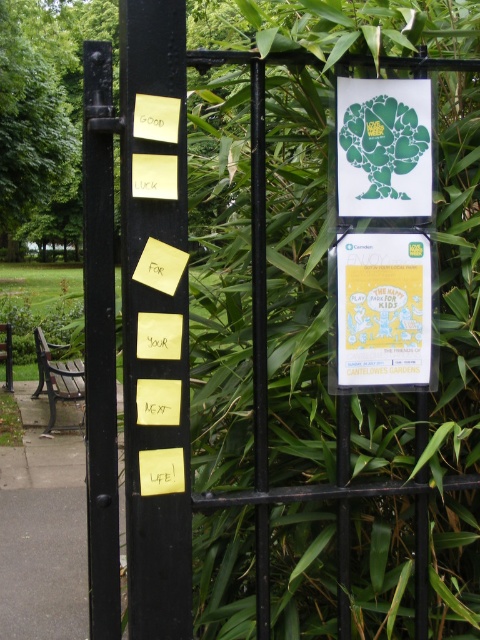
Question: Does wooden bench at lower left lie in front of wooden bench at left?

Choices:
 (A) no
 (B) yes

Answer: (B)

Question: Can you confirm if black metal post at left is positioned to the left of matte paper poster at upper right?

Choices:
 (A) yes
 (B) no

Answer: (A)

Question: Does matte paper poster at upper right appear on the left side of wooden bench at left?

Choices:
 (A) no
 (B) yes

Answer: (A)

Question: Which point is closer to the camera?

Choices:
 (A) matte paper poster at upper right
 (B) wooden bench at left
 (C) yellow paper notes at left
 (D) black metal post at left

Answer: (C)

Question: Which of the following is the farthest from the observer?

Choices:
 (A) (389, 340)
 (B) (107, 451)

Answer: (A)

Question: Which object is the closest to the wooden bench at left?

Choices:
 (A) yellow paper notes at left
 (B) black metal post at left
 (C) matte paper poster at upper right
 (D) green paper/plastic tree at upper center

Answer: (B)